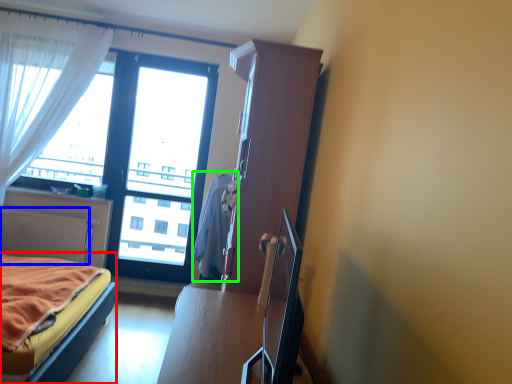
Question: Which object is positioned farthest from bed (highlighted by a red box)? Select from radiator (highlighted by a blue box) and blanket (highlighted by a green box).

Choices:
 (A) radiator
 (B) blanket

Answer: (A)